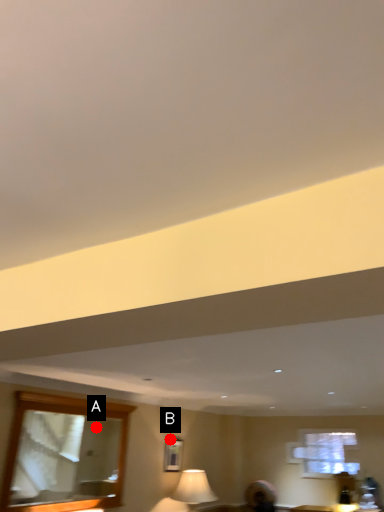
Question: Two points are circled on the image, labeled by A and B beside each circle. Which point is closer to the camera?

Choices:
 (A) A is closer
 (B) B is closer

Answer: (B)